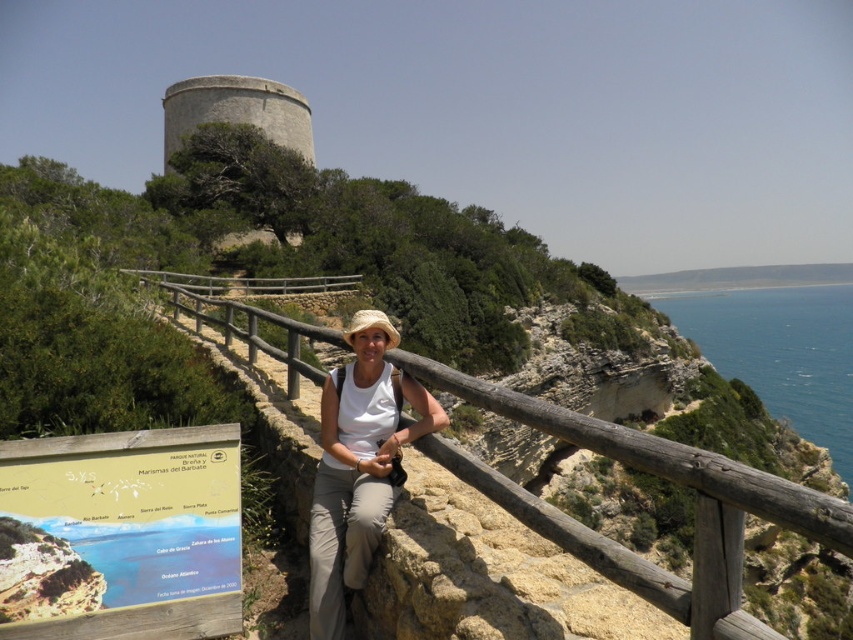
Does wooden at center appear on the right side of white matte shirt at center?

Incorrect, wooden at center is not on the right side of white matte shirt at center.

Is point (653, 579) less distant than point (352, 464)?

That is True.

Between point (223, 300) and point (363, 525), which one is positioned in front?

Positioned in front is point (363, 525).

Identify the location of wooden at center. pyautogui.click(x=653, y=474).